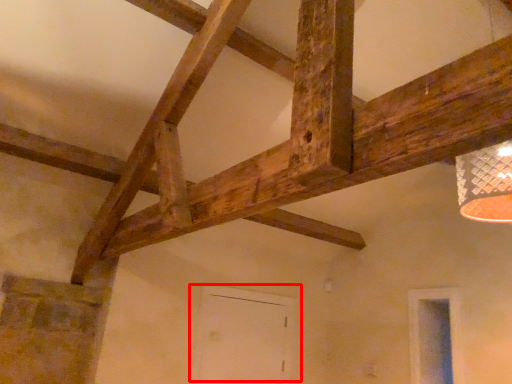
Question: From the image's perspective, where is door (annotated by the red box) located in relation to window in the image?

Choices:
 (A) above
 (B) below

Answer: (B)